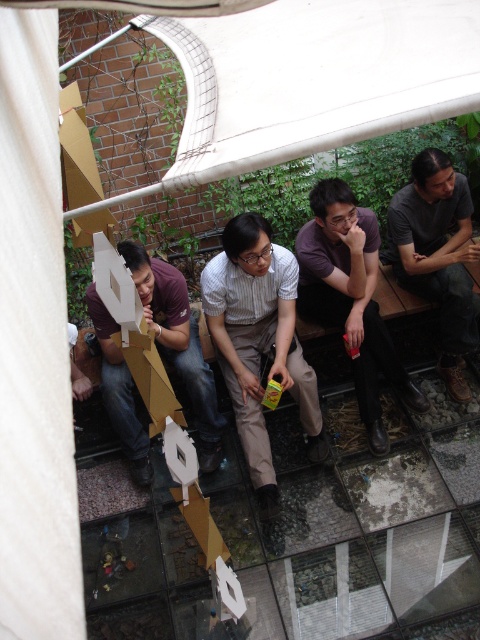
You are a photographer setting up for a group photo. You need to ensure there is enough space between the striped cotton shirt at center and the purple matte shirt at center to avoid overlapping in the frame. The minimum required distance for no overlap is 20 inches. Can they stay in their current positions?

The striped cotton shirt at center is 18.75 inches from the purple matte shirt at center. Since this distance is less than the required 20 inches, they need to move further apart to avoid overlapping in the frame.

From the picture: You are a photographer trying to capture a photo of the purple matte shirt at center and the dark gray shirt at right. Based on their positions, which one should you focus on first to ensure both are in frame without moving the camera?

The purple matte shirt at center is located below the dark gray shirt at right, so you should focus on the dark gray shirt at right first to ensure both are in frame without moving the camera.